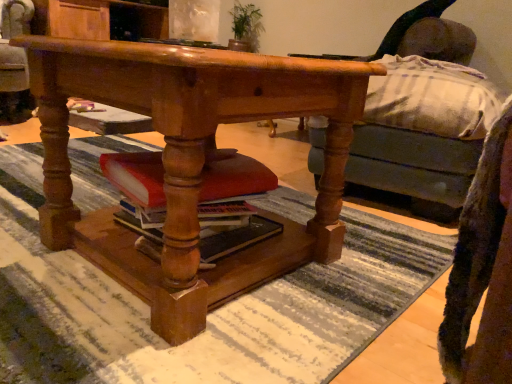
This screenshot has width=512, height=384. What do you see at coordinates (14, 63) in the screenshot?
I see `wooden swivel chair at center` at bounding box center [14, 63].

The width and height of the screenshot is (512, 384). What are the coordinates of `wooden swivel chair at center` in the screenshot? It's located at (14, 63).

The width and height of the screenshot is (512, 384). What do you see at coordinates (245, 27) in the screenshot? I see `green leafy plant at upper center` at bounding box center [245, 27].

Find the location of `matte red book at center`. matte red book at center is located at coordinates (232, 205).

The image size is (512, 384). What are the coordinates of `swivel chair below the green leafy plant at upper center (from a real-world perspective)` in the screenshot? It's located at (14, 63).

Is green leafy plant at upper center surrounding wooden swivel chair at center?

No, green leafy plant at upper center does not contain wooden swivel chair at center.

Does green leafy plant at upper center have a smaller size compared to wooden swivel chair at center?

Correct, green leafy plant at upper center occupies less space than wooden swivel chair at center.

Would you say green leafy plant at upper center is a long distance from wooden swivel chair at center?

Yes, green leafy plant at upper center is far from wooden swivel chair at center.

Is green leafy plant at upper center located within matte red book at center?

No.

From a real-world perspective, is matte red book at center positioned above or below green leafy plant at upper center?

Clearly, from a real-world perspective, matte red book at center is below green leafy plant at upper center.

Are wooden swivel chair at center and green leafy plant at upper center beside each other?

No, wooden swivel chair at center is not touching green leafy plant at upper center.

Which object is positioned more to the left, wooden swivel chair at center or green leafy plant at upper center?

wooden swivel chair at center.

Considering the relative sizes of wooden swivel chair at center and green leafy plant at upper center in the image provided, is wooden swivel chair at center taller than green leafy plant at upper center?

Indeed, wooden swivel chair at center has a greater height compared to green leafy plant at upper center.

Can you confirm if wooden swivel chair at center is thinner than green leafy plant at upper center?

In fact, wooden swivel chair at center might be wider than green leafy plant at upper center.

Does green leafy plant at upper center have a lesser height compared to wooden desk at center?

Indeed, green leafy plant at upper center has a lesser height compared to wooden desk at center.

Measure the distance from green leafy plant at upper center to wooden desk at center.

green leafy plant at upper center is 7.31 feet from wooden desk at center.

Does green leafy plant at upper center appear on the left side of wooden desk at center?

No.

From a real-world perspective, does green leafy plant at upper center stand above wooden desk at center?

Yes, from a real-world perspective, green leafy plant at upper center is over wooden desk at center

Locate an element on the screen. This screenshot has width=512, height=384. desk on the right side of matte red book at center is located at coordinates pyautogui.click(x=189, y=160).

Consider the image. Is matte red book at center bigger or smaller than wooden desk at center?

matte red book at center is smaller than wooden desk at center.

Which object is thinner, matte red book at center or wooden desk at center?

matte red book at center is thinner.

Can you confirm if wooden desk at center is thinner than green leafy plant at upper center?

In fact, wooden desk at center might be wider than green leafy plant at upper center.

Is wooden desk at center at the left side of green leafy plant at upper center?

Yes, wooden desk at center is to the left of green leafy plant at upper center.

Is wooden desk at center beside green leafy plant at upper center?

wooden desk at center and green leafy plant at upper center are clearly separated.

From the image's perspective, is wooden desk at center above or below green leafy plant at upper center?

Based on their image positions, wooden desk at center is located beneath green leafy plant at upper center.

In the scene shown: Is wooden swivel chair at center not within matte red book at center?

wooden swivel chair at center is positioned outside matte red book at center.

Considering the positions of objects wooden swivel chair at center and matte red book at center in the image provided, who is more to the left, wooden swivel chair at center or matte red book at center?

Positioned to the left is wooden swivel chair at center.

From a real-world perspective, between wooden swivel chair at center and matte red book at center, who is vertically higher?

wooden swivel chair at center.

Is wooden swivel chair at center facing away from matte red book at center?

No, wooden swivel chair at center is not facing away from matte red book at center.

This screenshot has height=384, width=512. What are the coordinates of `houseplant above the wooden swivel chair at center (from the image's perspective)` in the screenshot? It's located at (245, 27).

The width and height of the screenshot is (512, 384). I want to click on houseplant on the right of matte red book at center, so click(x=245, y=27).

Estimate the real-world distances between objects in this image. Which object is closer to wooden desk at center, matte red book at center or green leafy plant at upper center?

matte red book at center.

Which object lies further to the anchor point matte red book at center, wooden swivel chair at center or wooden desk at center?

wooden swivel chair at center is positioned further to the anchor matte red book at center.

Which object lies further to the anchor point wooden swivel chair at center, matte red book at center or wooden desk at center?

wooden desk at center lies further to wooden swivel chair at center than the other object.

From the image, which object appears to be farther from matte red book at center, wooden swivel chair at center or green leafy plant at upper center?

The object further to matte red book at center is green leafy plant at upper center.

Which object lies nearer to the anchor point matte red book at center, green leafy plant at upper center or wooden desk at center?

wooden desk at center lies closer to matte red book at center than the other object.

Looking at the image, which one is located closer to wooden desk at center, wooden swivel chair at center or green leafy plant at upper center?

wooden swivel chair at center lies closer to wooden desk at center than the other object.

Looking at the image, which one is located further to wooden desk at center, green leafy plant at upper center or wooden swivel chair at center?

green leafy plant at upper center.

Considering their positions, is wooden desk at center positioned further to wooden swivel chair at center than matte red book at center?

Among the two, wooden desk at center is located further to wooden swivel chair at center.

This screenshot has height=384, width=512. What are the coordinates of `book between wooden desk at center and green leafy plant at upper center in the front-back direction` in the screenshot? It's located at (232, 205).

Locate an element on the screen. The height and width of the screenshot is (384, 512). swivel chair between matte red book at center and green leafy plant at upper center from front to back is located at coordinates (14, 63).

Identify the location of swivel chair positioned between wooden desk at center and green leafy plant at upper center from near to far. The width and height of the screenshot is (512, 384). (14, 63).

This screenshot has height=384, width=512. Identify the location of book between wooden desk at center and wooden swivel chair at center in the front-back direction. (232, 205).